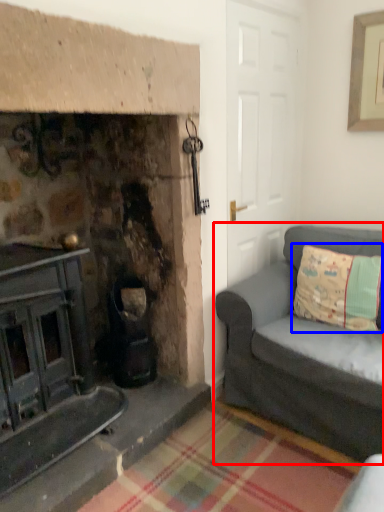
Question: Which object is further to the camera taking this photo, studio couch (highlighted by a red box) or pillow (highlighted by a blue box)?

Choices:
 (A) studio couch
 (B) pillow

Answer: (B)